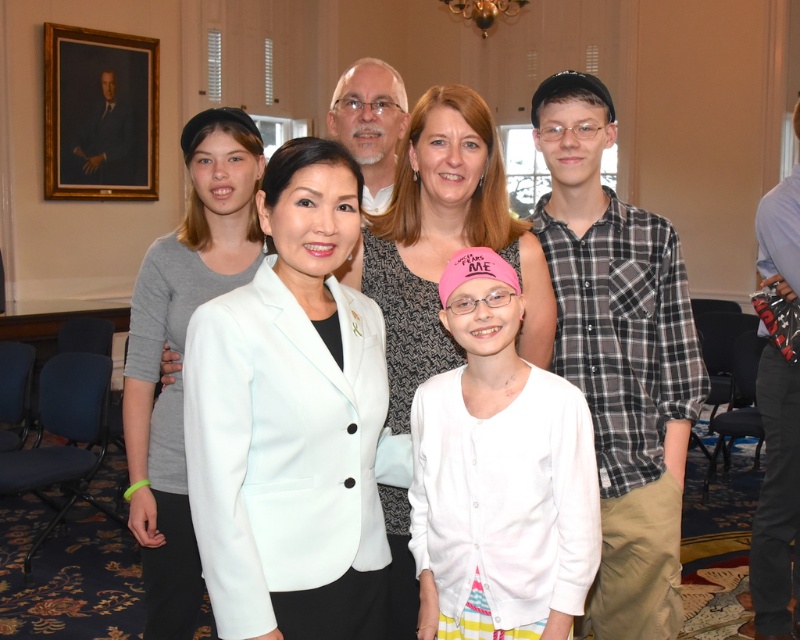
What is located at the coordinates point (500, 474)?

The pink fabric cap at center is located at point (500, 474).

Looking at this image, based on the scene description, can you determine the spatial relationship between the light blue fabric jacket at center and the dark blue canvas portrait at upper left?

The light blue fabric jacket at center is to the right of the dark blue canvas portrait at upper left.

Based on the scene description, where is the matte gray sweater at center located in the image coordinates?

The matte gray sweater at center is located at point coordinates of (444, 241).